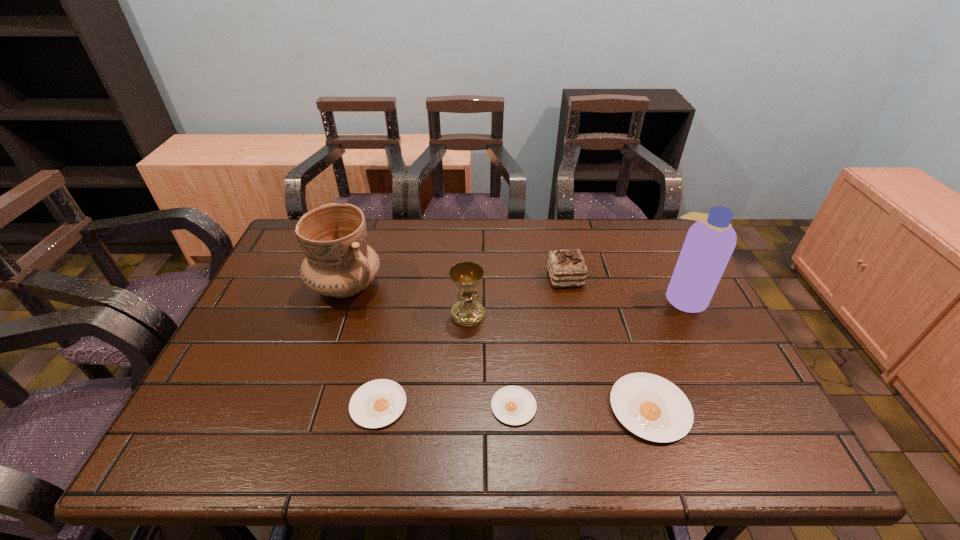
The image size is (960, 540). I want to click on object located in the right edge section of the desktop, so click(710, 242).

In the image, there is a desktop. At what (x,y) coordinates should I click in order to perform the action: click on free space at the far edge. Please return your answer as a coordinate pair (x, y). This screenshot has height=540, width=960. Looking at the image, I should click on 451,251.

In the image, there is a desktop. Identify the location of free region at the near edge. The height and width of the screenshot is (540, 960). (294, 395).

The width and height of the screenshot is (960, 540). I want to click on vacant space at the left edge of the desktop, so click(x=290, y=267).

In the image, there is a desktop. Where is `vacant space at the far left corner`? This screenshot has height=540, width=960. vacant space at the far left corner is located at coordinates (277, 260).

In the image, there is a desktop. Where is `vacant region at the far right corner`? The image size is (960, 540). vacant region at the far right corner is located at coordinates (667, 235).

I want to click on vacant area that lies between the shortest object and the second shortest egg yolk, so click(x=446, y=406).

The image size is (960, 540). Find the location of `vacant point located between the third shortest object and the fourth object from right to left`. vacant point located between the third shortest object and the fourth object from right to left is located at coordinates [582, 407].

Image resolution: width=960 pixels, height=540 pixels. I want to click on vacant space that's between the chocolate cake and the second egg yolk from right to left, so click(x=540, y=342).

I want to click on free space between the fifth object from right to left and the rightmost object, so click(x=576, y=306).